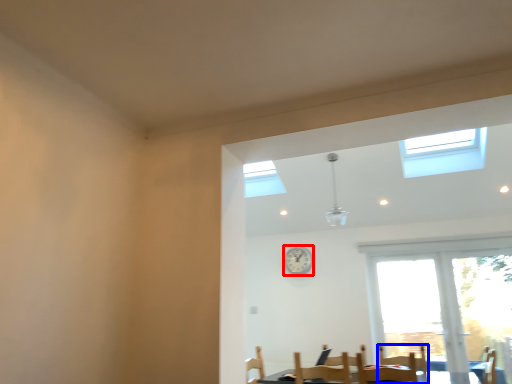
Question: Which object appears farthest to the camera in this image, clock (highlighted by a red box) or armchair (highlighted by a blue box)?

Choices:
 (A) clock
 (B) armchair

Answer: (A)